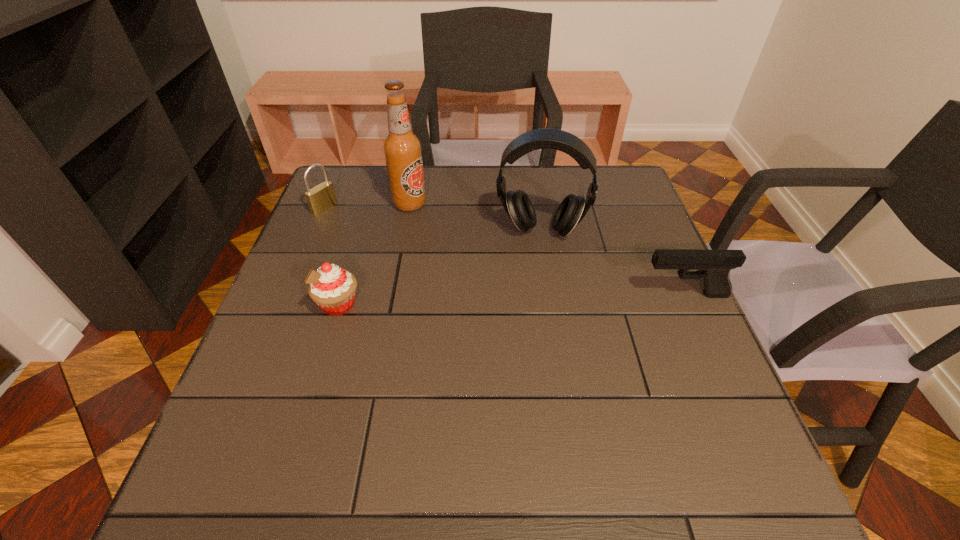
You are a GUI agent. You are given a task and a screenshot of the screen. Output one action in this format:
    pyautogui.click(x=<x>, y=<y>)
    Task: Click on the vacant space at the far left corner
    Image resolution: width=960 pixels, height=540 pixels.
    Given the screenshot: What is the action you would take?
    pyautogui.click(x=328, y=176)

In the image, there is a desktop. Where is `vacant space at the far right corner`? This screenshot has height=540, width=960. vacant space at the far right corner is located at coordinates (611, 202).

You are a GUI agent. You are given a task and a screenshot of the screen. Output one action in this format:
    pyautogui.click(x=<x>, y=<y>)
    Task: Click on the free area in between the pistol and the leftmost object
    
    Given the screenshot: What is the action you would take?
    pyautogui.click(x=504, y=252)

The image size is (960, 540). Identify the location of free area in between the rightmost object and the beer bottle. (547, 249).

Find the location of `empty location between the beer bottle and the second tallest object`. empty location between the beer bottle and the second tallest object is located at coordinates (475, 217).

At what (x,y) coordinates should I click in order to perform the action: click on free space between the leftmost object and the tallest object. Please return your answer as a coordinate pair (x, y). The image size is (960, 540). Looking at the image, I should click on (368, 206).

Find the location of a particular element. vacant area that lies between the pistol and the padlock is located at coordinates (504, 252).

Identify the location of free space between the earphone and the padlock. (433, 219).

At what (x,y) coordinates should I click in order to perform the action: click on unoccupied area between the second object from right to left and the padlock. Please return your answer as a coordinate pair (x, y). Looking at the image, I should click on (433, 219).

Identify the location of free point between the third object from right to left and the padlock. Image resolution: width=960 pixels, height=540 pixels. (368, 206).